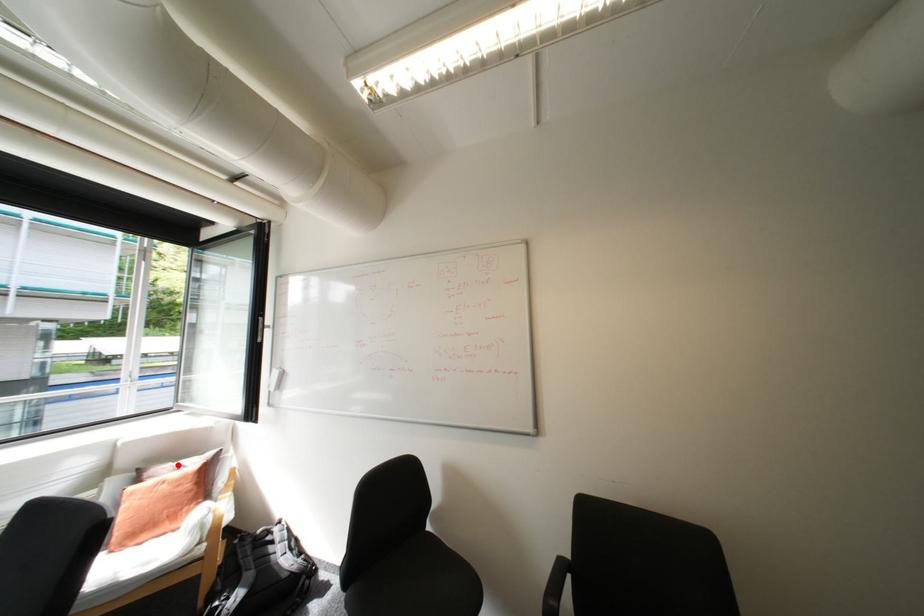
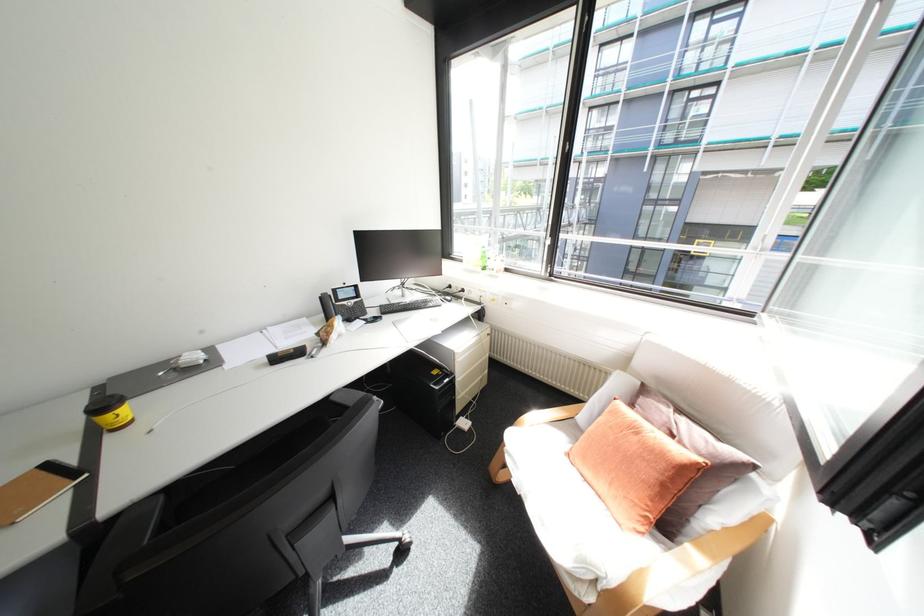
Find the pixel in the second image that matches the highlighted location in the first image.

(677, 410)